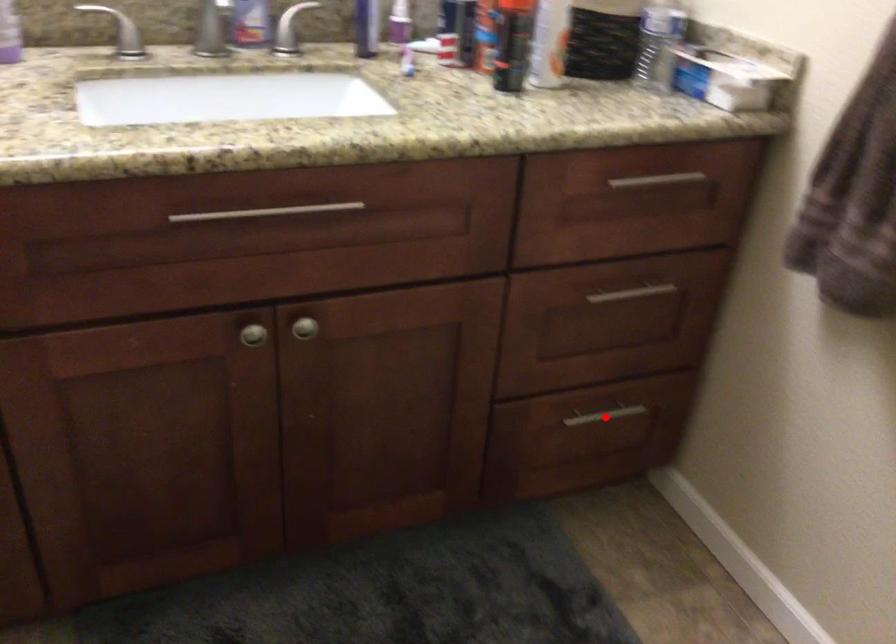
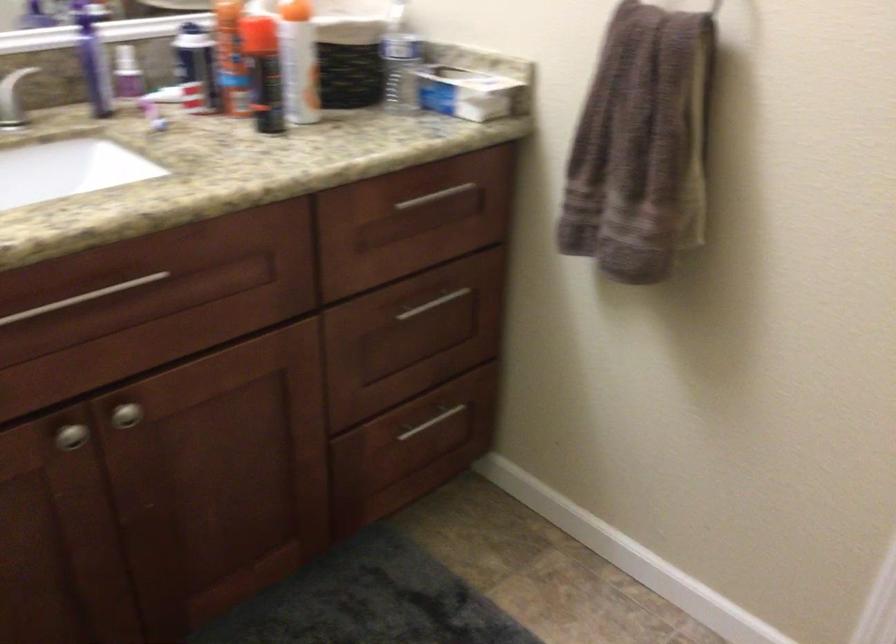
Question: I am providing you with two images of the same scene from different viewpoints. A red point is marked on the first image. At the location where the point appears in image 1, is it still visible in image 2?

Choices:
 (A) Yes
 (B) No

Answer: (A)